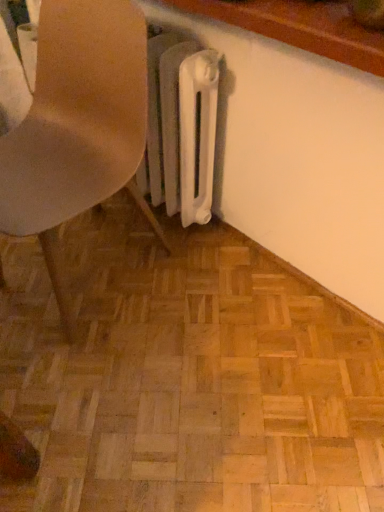
What is the approximate height of matte plastic chair at lower left?

The height of matte plastic chair at lower left is 81.24 centimeters.

What do you see at coordinates (77, 129) in the screenshot?
I see `matte plastic chair at lower left` at bounding box center [77, 129].

The height and width of the screenshot is (512, 384). I want to click on matte plastic chair at lower left, so click(x=77, y=129).

The width and height of the screenshot is (384, 512). What do you see at coordinates (187, 377) in the screenshot?
I see `natural wood parquet floor at center` at bounding box center [187, 377].

In order to click on natural wood parquet floor at center in this screenshot , I will do `click(187, 377)`.

The height and width of the screenshot is (512, 384). I want to click on matte plastic chair at lower left, so pos(77,129).

From the picture: Considering the positions of objects natural wood parquet floor at center and matte plastic chair at lower left in the image provided, who is more to the left, natural wood parquet floor at center or matte plastic chair at lower left?

From the viewer's perspective, matte plastic chair at lower left appears more on the left side.

Who is more distant, natural wood parquet floor at center or matte plastic chair at lower left?

natural wood parquet floor at center.

Between point (189, 417) and point (87, 92), which one is positioned behind?

Positioned behind is point (87, 92).

From the image's perspective, does natural wood parquet floor at center appear lower than matte plastic chair at lower left?

Correct, natural wood parquet floor at center appears lower than matte plastic chair at lower left in the image.

From a real-world perspective, which object stands above the other?

From a 3D spatial view, matte plastic chair at lower left is above.

Between natural wood parquet floor at center and matte plastic chair at lower left, which one has larger width?

Wider between the two is natural wood parquet floor at center.

Considering the sizes of natural wood parquet floor at center and matte plastic chair at lower left in the image, is natural wood parquet floor at center taller or shorter than matte plastic chair at lower left?

natural wood parquet floor at center is shorter than matte plastic chair at lower left.

Based on their sizes in the image, would you say natural wood parquet floor at center is bigger or smaller than matte plastic chair at lower left?

natural wood parquet floor at center is smaller than matte plastic chair at lower left.

Is natural wood parquet floor at center positioned beyond the bounds of matte plastic chair at lower left?

Absolutely, natural wood parquet floor at center is external to matte plastic chair at lower left.

Is natural wood parquet floor at center not near matte plastic chair at lower left?

No, natural wood parquet floor at center is not far from matte plastic chair at lower left.

Is natural wood parquet floor at center facing towards matte plastic chair at lower left?

No, natural wood parquet floor at center is not oriented towards matte plastic chair at lower left.

How different are the orientations of natural wood parquet floor at center and matte plastic chair at lower left in degrees?

The angle between the facing direction of natural wood parquet floor at center and the facing direction of matte plastic chair at lower left is 5.24 degrees.

How distant is natural wood parquet floor at center from matte plastic chair at lower left?

They are 17.10 inches apart.

This screenshot has height=512, width=384. I want to click on chair in front of the natural wood parquet floor at center, so click(x=77, y=129).

Considering the relative positions of matte plastic chair at lower left and natural wood parquet floor at center in the image provided, is matte plastic chair at lower left to the left or to the right of natural wood parquet floor at center?

matte plastic chair at lower left is to the left of natural wood parquet floor at center.

Considering the relative positions of matte plastic chair at lower left and natural wood parquet floor at center in the image provided, is matte plastic chair at lower left in front of natural wood parquet floor at center?

Yes, matte plastic chair at lower left is closer to the viewer.

Which is behind, point (79, 5) or point (314, 294)?

The point (314, 294) is farther from the camera.

From the image's perspective, relative to natural wood parquet floor at center, is matte plastic chair at lower left above or below?

matte plastic chair at lower left is above natural wood parquet floor at center.

From a real-world perspective, relative to natural wood parquet floor at center, is matte plastic chair at lower left vertically above or below?

From a real-world perspective, matte plastic chair at lower left is physically above natural wood parquet floor at center.

Considering the sizes of matte plastic chair at lower left and natural wood parquet floor at center in the image, is matte plastic chair at lower left wider or thinner than natural wood parquet floor at center?

Clearly, matte plastic chair at lower left has less width compared to natural wood parquet floor at center.

Between matte plastic chair at lower left and natural wood parquet floor at center, which one has more height?

Standing taller between the two is matte plastic chair at lower left.

Considering the sizes of objects matte plastic chair at lower left and natural wood parquet floor at center in the image provided, who is bigger, matte plastic chair at lower left or natural wood parquet floor at center?

Bigger between the two is matte plastic chair at lower left.

Is matte plastic chair at lower left spatially inside natural wood parquet floor at center, or outside of it?

matte plastic chair at lower left is not inside natural wood parquet floor at center, it's outside.

Would you consider matte plastic chair at lower left to be distant from natural wood parquet floor at center?

No, matte plastic chair at lower left is in close proximity to natural wood parquet floor at center.

Could you tell me if matte plastic chair at lower left is turned towards natural wood parquet floor at center?

No, matte plastic chair at lower left is not facing towards natural wood parquet floor at center.

Can you tell me how much matte plastic chair at lower left and natural wood parquet floor at center differ in facing direction?

The facing directions of matte plastic chair at lower left and natural wood parquet floor at center are 5.24 degrees apart.

Find the location of a particular element. The height and width of the screenshot is (512, 384). plywood below the matte plastic chair at lower left (from the image's perspective) is located at coordinates (187, 377).

You are a GUI agent. You are given a task and a screenshot of the screen. Output one action in this format:
    pyautogui.click(x=<x>, y=<y>)
    Task: Click on the plywood lying behind the matte plastic chair at lower left
    This screenshot has width=384, height=512.
    Given the screenshot: What is the action you would take?
    pyautogui.click(x=187, y=377)

This screenshot has width=384, height=512. In order to click on chair in front of the natural wood parquet floor at center in this screenshot , I will do `click(77, 129)`.